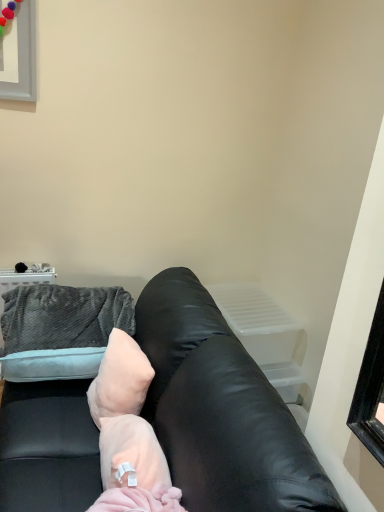
Question: Does pale pink plush pillow at center have a lesser height compared to pink fluffy blanket at center?

Choices:
 (A) no
 (B) yes

Answer: (A)

Question: Considering the relative positions of pale pink plush pillow at center and pink fluffy blanket at center in the image provided, is pale pink plush pillow at center to the left of pink fluffy blanket at center from the viewer's perspective?

Choices:
 (A) no
 (B) yes

Answer: (B)

Question: From the image's perspective, does pale pink plush pillow at center appear lower than pink fluffy blanket at center?

Choices:
 (A) yes
 (B) no

Answer: (B)

Question: From a real-world perspective, is pale pink plush pillow at center located beneath pink fluffy blanket at center?

Choices:
 (A) yes
 (B) no

Answer: (B)

Question: Is pale pink plush pillow at center smaller than pink fluffy blanket at center?

Choices:
 (A) yes
 (B) no

Answer: (A)

Question: Is pale pink plush pillow at center positioned beyond the bounds of pink fluffy blanket at center?

Choices:
 (A) no
 (B) yes

Answer: (B)

Question: Does pale pink plush pillow at center lie behind black leather couch at center?

Choices:
 (A) no
 (B) yes

Answer: (B)

Question: From a real-world perspective, is pale pink plush pillow at center physically below black leather couch at center?

Choices:
 (A) no
 (B) yes

Answer: (A)

Question: From a real-world perspective, is pale pink plush pillow at center on top of black leather couch at center?

Choices:
 (A) no
 (B) yes

Answer: (B)

Question: Is pale pink plush pillow at center smaller than black leather couch at center?

Choices:
 (A) yes
 (B) no

Answer: (A)

Question: Is pale pink plush pillow at center thinner than black leather couch at center?

Choices:
 (A) yes
 (B) no

Answer: (A)

Question: Can you confirm if pale pink plush pillow at center is positioned to the left of black leather couch at center?

Choices:
 (A) no
 (B) yes

Answer: (A)

Question: Is pink fluffy blanket at center shorter than black leather couch at center?

Choices:
 (A) yes
 (B) no

Answer: (A)